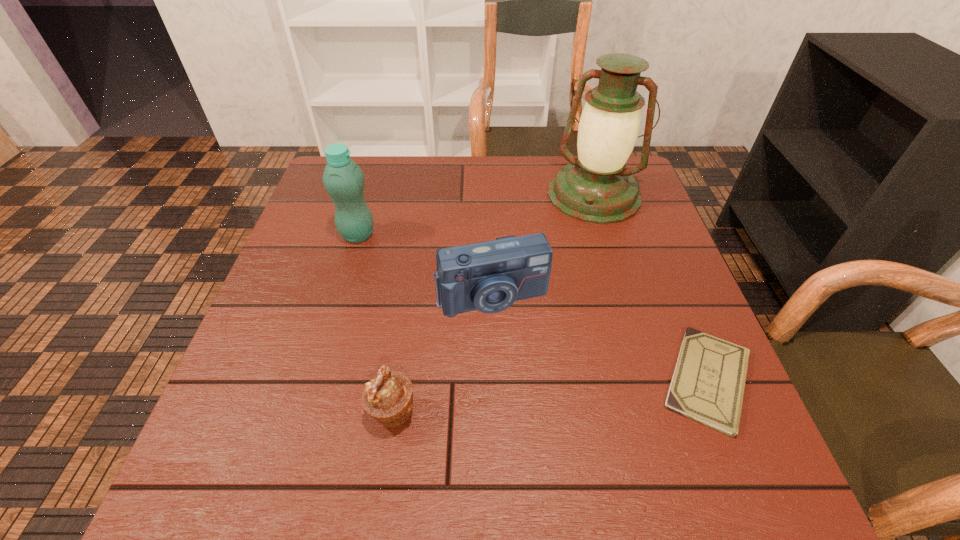
In order to click on vacant area in the image that satisfies the following two spatial constraints: 1. on the front side of the checkbook; 2. on the right side of the tallest object in this screenshot , I will do `click(650, 380)`.

Locate an element on the screen. vacant space that satisfies the following two spatial constraints: 1. on the front side of the shortest object; 2. on the left side of the water bottle is located at coordinates [x=315, y=380].